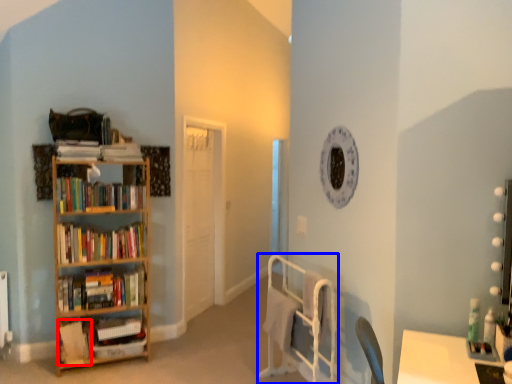
Question: Which object appears farthest to the camera in this image, book (highlighted by a red box) or bed frame (highlighted by a blue box)?

Choices:
 (A) book
 (B) bed frame

Answer: (A)